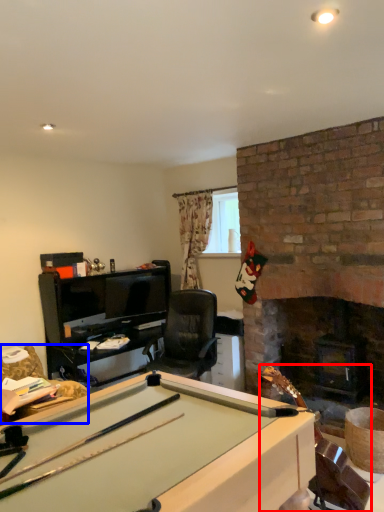
Question: Which object appears closest to the camera in this image, equipment (highlighted by a red box) or swivel chair (highlighted by a blue box)?

Choices:
 (A) equipment
 (B) swivel chair

Answer: (A)